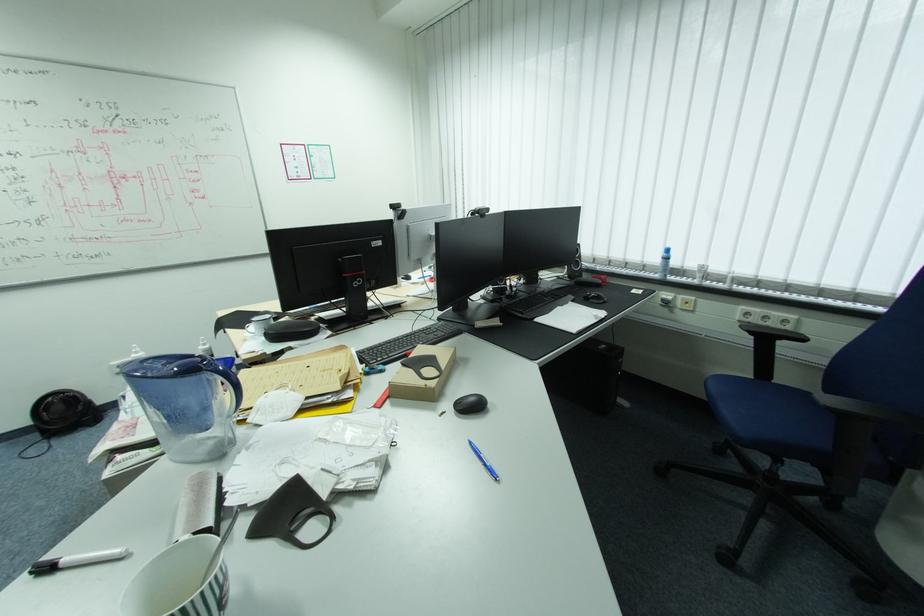
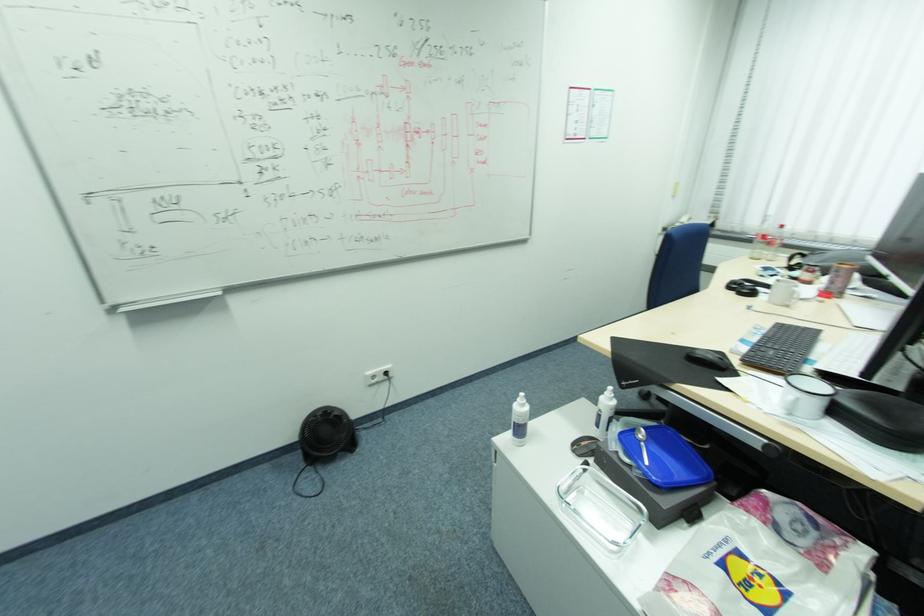
The images are taken continuously from a first-person perspective. In which direction are you moving?

The movement direction of the cameraman is left, forward.